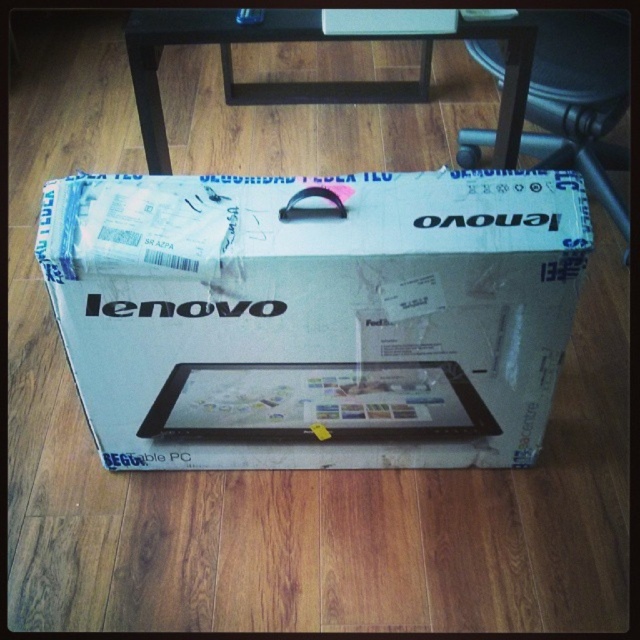
Does white cardboard box at center have a larger size compared to wooden stool at center?

Yes, white cardboard box at center is bigger than wooden stool at center.

Is white cardboard box at center smaller than wooden stool at center?

No.

Where is `white cardboard box at center`? The width and height of the screenshot is (640, 640). white cardboard box at center is located at coordinates (316, 314).

You are a GUI agent. You are given a task and a screenshot of the screen. Output one action in this format:
    pyautogui.click(x=<x>, y=<y>)
    Task: Click on the white cardboard box at center
    This screenshot has height=640, width=640.
    Given the screenshot: What is the action you would take?
    pyautogui.click(x=316, y=314)

In order to click on white cardboard box at center in this screenshot , I will do `click(316, 314)`.

Does white cardboard box at center appear on the left side of matte black tablet at center?

Incorrect, white cardboard box at center is not on the left side of matte black tablet at center.

Measure the distance between white cardboard box at center and camera.

white cardboard box at center and camera are 1.02 meters apart from each other.

The width and height of the screenshot is (640, 640). Identify the location of white cardboard box at center. (316, 314).

Does point (369, 369) come farther from viewer compared to point (580, 148)?

No, it is not.

Who is more forward, (218, 385) or (538, 164)?

Positioned in front is point (218, 385).

Image resolution: width=640 pixels, height=640 pixels. What are the coordinates of `matte black tablet at center` in the screenshot? It's located at (317, 403).